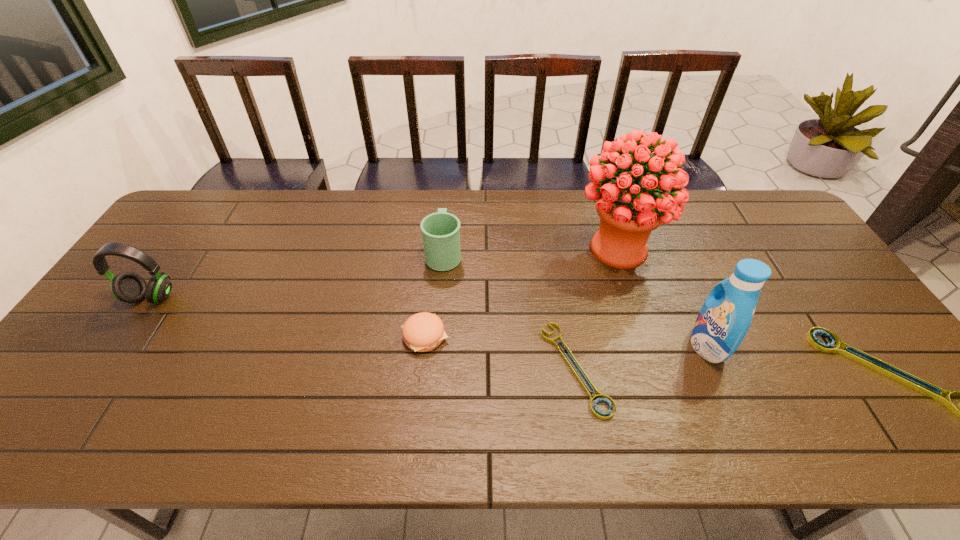
I want to click on unoccupied area between the mug and the leftmost object, so click(x=298, y=275).

Identify which object is the sixth closest to the left wrench. Please provide its 2D coordinates. Your answer should be formatted as a tuple, i.e. [(x, y)], where the tuple contains the x and y coordinates of a point satisfying the conditions above.

[(129, 287)]

Locate an element on the screen. This screenshot has height=540, width=960. object that is the second closest to the third tallest object is located at coordinates (441, 231).

Image resolution: width=960 pixels, height=540 pixels. I want to click on free spot that satisfies the following two spatial constraints: 1. on the ear cups of the shorter wrench; 2. on the left side of the third farthest object, so click(x=102, y=368).

Locate an element on the screen. The height and width of the screenshot is (540, 960). vacant space that satisfies the following two spatial constraints: 1. on the front side of the third shortest object; 2. on the left side of the shortest object is located at coordinates (421, 368).